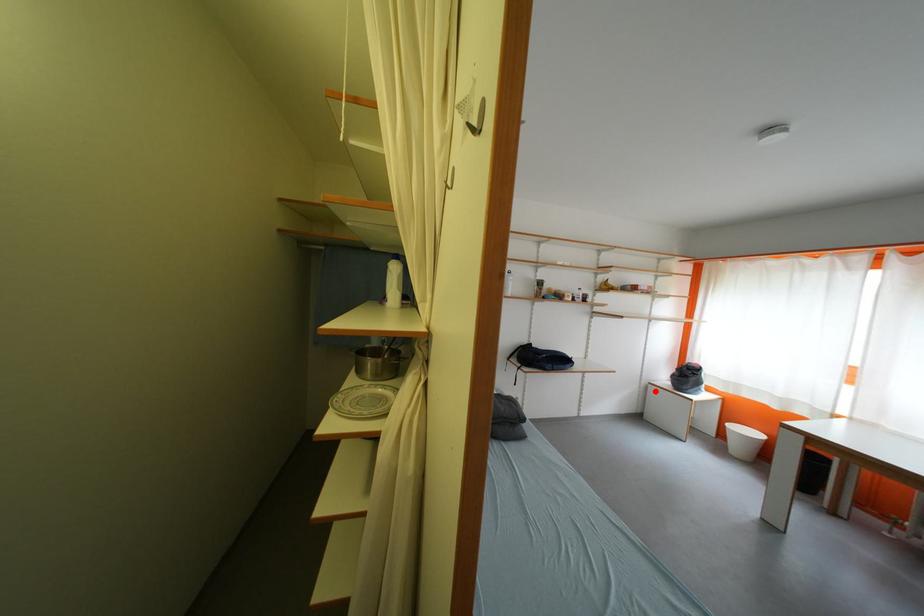
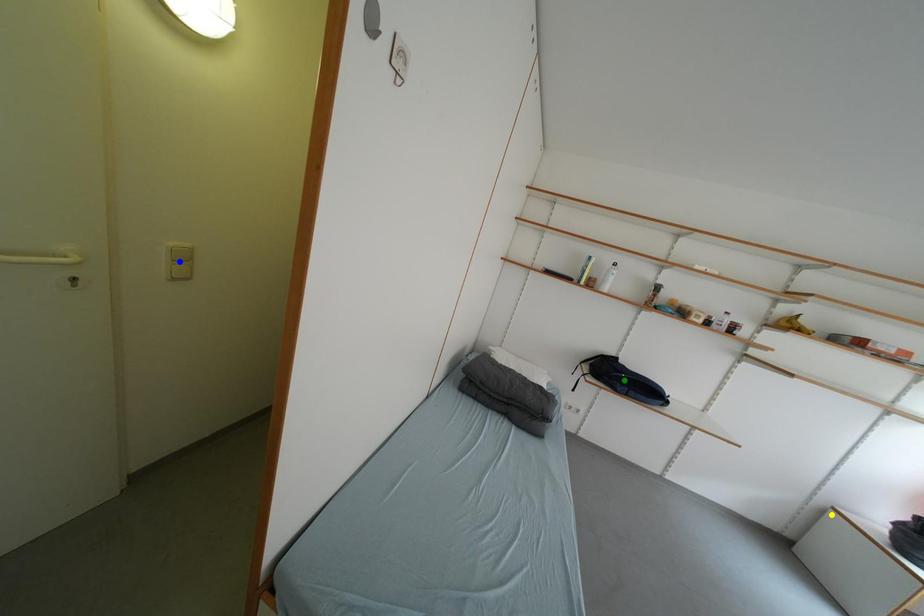
Question: I am providing you with two images of the same scene from different viewpoints. A red point is marked on the first image. You are given multiple points on the second image. Which mark in image 2 goes with the point in image 1?

Choices:
 (A) yellow point
 (B) green point
 (C) blue point

Answer: (A)